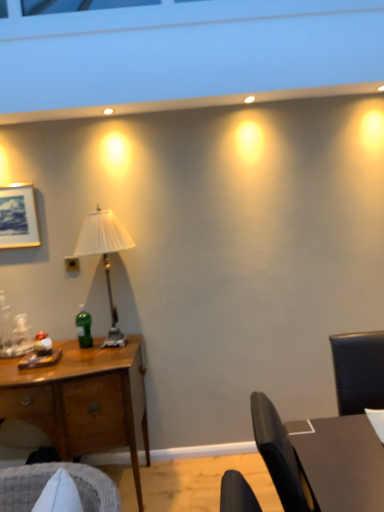
Question: Can you confirm if dark brown wooden table at right is taller than wooden desk at left?

Choices:
 (A) yes
 (B) no

Answer: (B)

Question: From a real-world perspective, is dark brown wooden table at right located higher than wooden desk at left?

Choices:
 (A) no
 (B) yes

Answer: (B)

Question: Does dark brown wooden table at right come in front of wooden desk at left?

Choices:
 (A) yes
 (B) no

Answer: (A)

Question: Is dark brown wooden table at right aimed at wooden desk at left?

Choices:
 (A) no
 (B) yes

Answer: (A)

Question: Is dark brown wooden table at right shorter than wooden desk at left?

Choices:
 (A) no
 (B) yes

Answer: (B)

Question: Is dark brown wooden table at right facing away from wooden desk at left?

Choices:
 (A) no
 (B) yes

Answer: (A)

Question: Is white pleated fabric lampshade at left bigger than dark brown wooden table at right?

Choices:
 (A) yes
 (B) no

Answer: (B)

Question: Can you confirm if white pleated fabric lampshade at left is wider than dark brown wooden table at right?

Choices:
 (A) no
 (B) yes

Answer: (A)

Question: Can you confirm if white pleated fabric lampshade at left is shorter than dark brown wooden table at right?

Choices:
 (A) yes
 (B) no

Answer: (B)

Question: From a real-world perspective, is white pleated fabric lampshade at left on dark brown wooden table at right?

Choices:
 (A) no
 (B) yes

Answer: (B)

Question: Does white pleated fabric lampshade at left lie in front of dark brown wooden table at right?

Choices:
 (A) yes
 (B) no

Answer: (B)

Question: Is white pleated fabric lampshade at left further to the viewer compared to dark brown wooden table at right?

Choices:
 (A) yes
 (B) no

Answer: (A)

Question: Is green glass bottle at center-left not inside white pleated fabric lampshade at left?

Choices:
 (A) yes
 (B) no

Answer: (B)